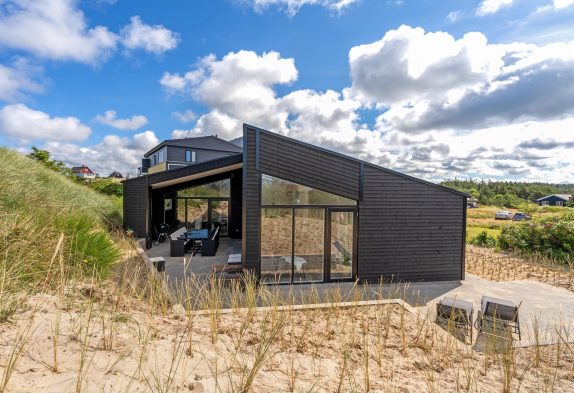
In order to click on couches in this screenshot , I will do `click(212, 239)`, `click(173, 245)`.